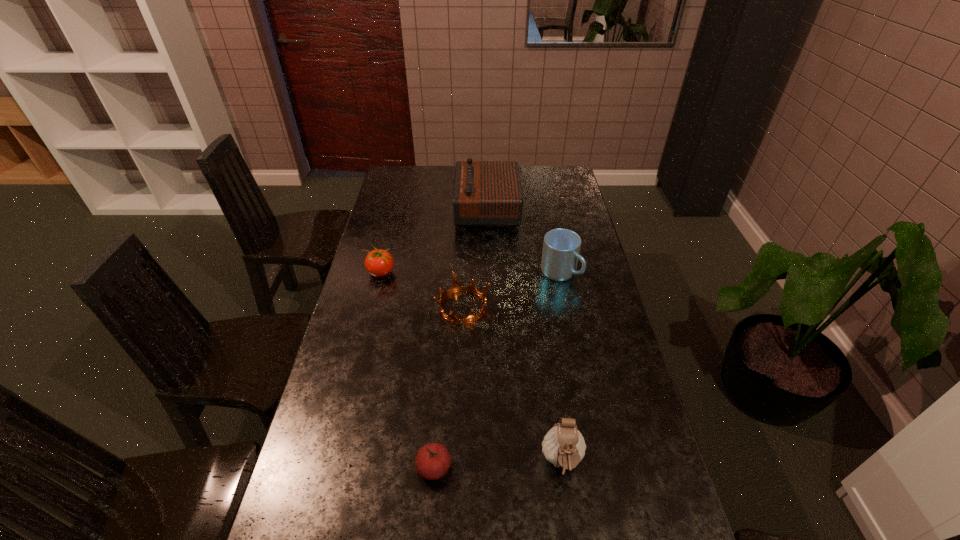
Find the location of `free space at the left edge of the desktop`. free space at the left edge of the desktop is located at coordinates (310, 438).

The width and height of the screenshot is (960, 540). In the image, there is a desktop. In order to click on free space at the right edge in this screenshot , I will do `click(607, 335)`.

In the image, there is a desktop. Find the location of `vacant space at the far left corner`. vacant space at the far left corner is located at coordinates (402, 174).

What are the coordinates of `vacant area that lies between the crown and the farthest object` in the screenshot? It's located at (475, 258).

The height and width of the screenshot is (540, 960). Find the location of `vacant space in between the farthest object and the third nearest object`. vacant space in between the farthest object and the third nearest object is located at coordinates (475, 258).

Where is `vacant area that lies between the farthest object and the crown`? The image size is (960, 540). vacant area that lies between the farthest object and the crown is located at coordinates (475, 258).

Image resolution: width=960 pixels, height=540 pixels. Identify the location of free space between the fourth farthest object and the shorter tomato. (448, 387).

This screenshot has width=960, height=540. In order to click on vacant space that's between the mug and the pouch in this screenshot , I will do `click(561, 367)`.

Where is `vacant space that's between the pouch and the shorter tomato`? vacant space that's between the pouch and the shorter tomato is located at coordinates (498, 464).

This screenshot has width=960, height=540. What are the coordinates of `free spot between the crown and the mug` in the screenshot? It's located at (512, 289).